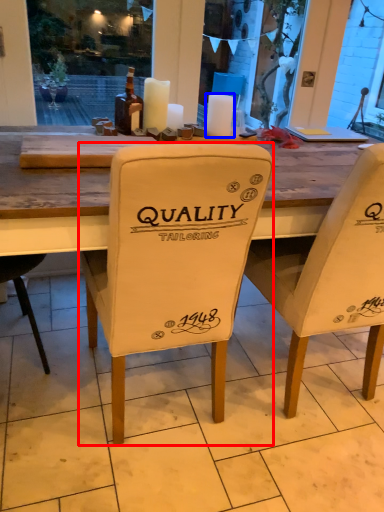
Question: Which point is further to the camera, chair (highlighted by a red box) or candle (highlighted by a blue box)?

Choices:
 (A) chair
 (B) candle

Answer: (B)